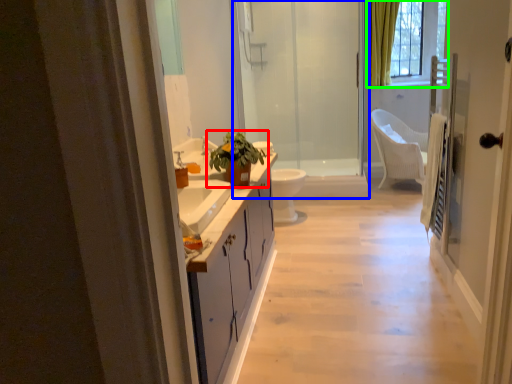
Question: Estimate the real-world distances between objects in this image. Which object is farther from houseplant (highlighted by a red box), shower door (highlighted by a blue box) or window (highlighted by a green box)?

Choices:
 (A) shower door
 (B) window

Answer: (B)